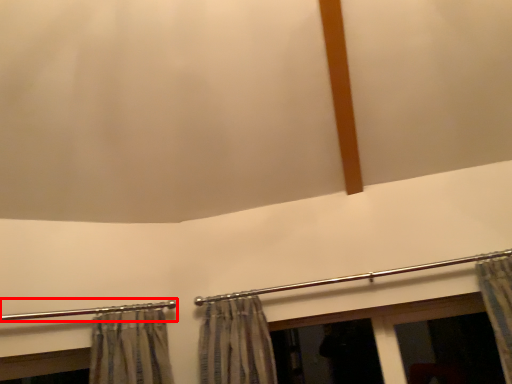
Question: Observing the image, what is the correct spatial positioning of clothesline (annotated by the red box) in reference to clothesline?

Choices:
 (A) left
 (B) right

Answer: (A)